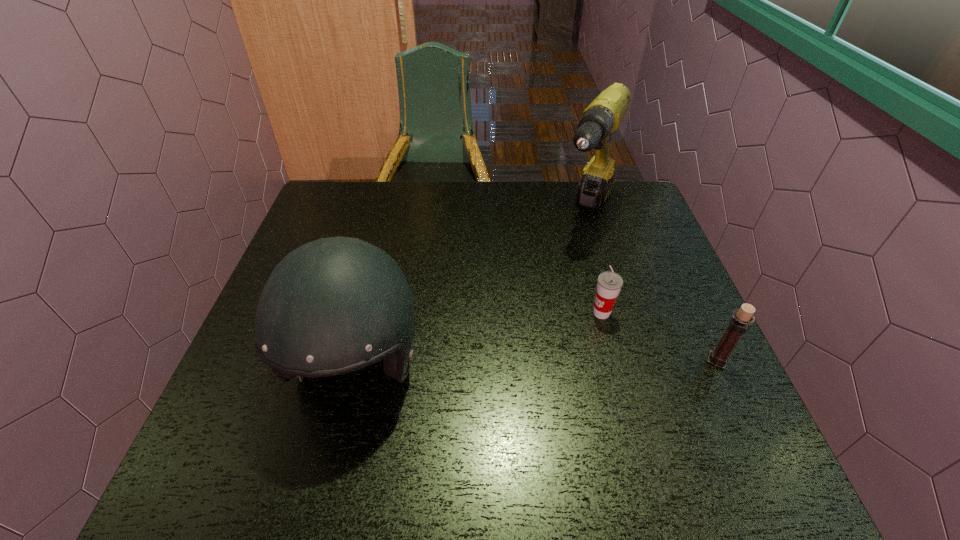
Find the location of a particular element. This screenshot has height=540, width=960. the leftmost object is located at coordinates (335, 305).

Identify the location of football helmet. The image size is (960, 540). (335, 305).

Find the location of a particular element. The height and width of the screenshot is (540, 960). the rightmost object is located at coordinates (738, 325).

The image size is (960, 540). Identify the location of drill. (602, 117).

This screenshot has height=540, width=960. I want to click on the shortest object, so click(609, 284).

Locate an element on the screen. free space located on the left of the rightmost object is located at coordinates (664, 360).

Identify the location of blank area located on the handle side of the farthest object. Image resolution: width=960 pixels, height=540 pixels. [x=568, y=262].

Locate an element on the screen. The image size is (960, 540). free space located 0.290m on the handle side of the farthest object is located at coordinates (540, 312).

Locate an element on the screen. free space located on the handle side of the farthest object is located at coordinates (533, 326).

Locate an element on the screen. The width and height of the screenshot is (960, 540). vacant area situated on the side of the cup with the logo is located at coordinates (482, 384).